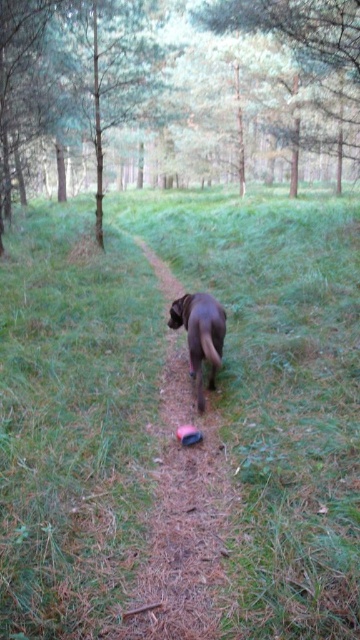
You are a hiker trying to walk along the narrow dirt path in the forest. You see the green grassy at center and the brown matte dog at center. Which one is wider?

The green grassy at center is wider than the brown matte dog at center according to the description.

You are standing on the dirt path in the forest and see two points marked in the scene. The first point is at coordinates point (57, 308) and the second is at point (182, 342). Which point is closer to you?

Point (57, 308) is closer to you because it is further to the camera than point (182, 342).

You are a hiker walking on the narrow dirt path in the forest scene. You notice two dogs ahead of you on the path. One is labeled as the brown fur dog at center and the other as the brown matte dog at center. Which dog is positioned lower on the path?

The brown fur dog at center is positioned lower than the brown matte dog at center, so the brown fur dog at center is lower on the path.